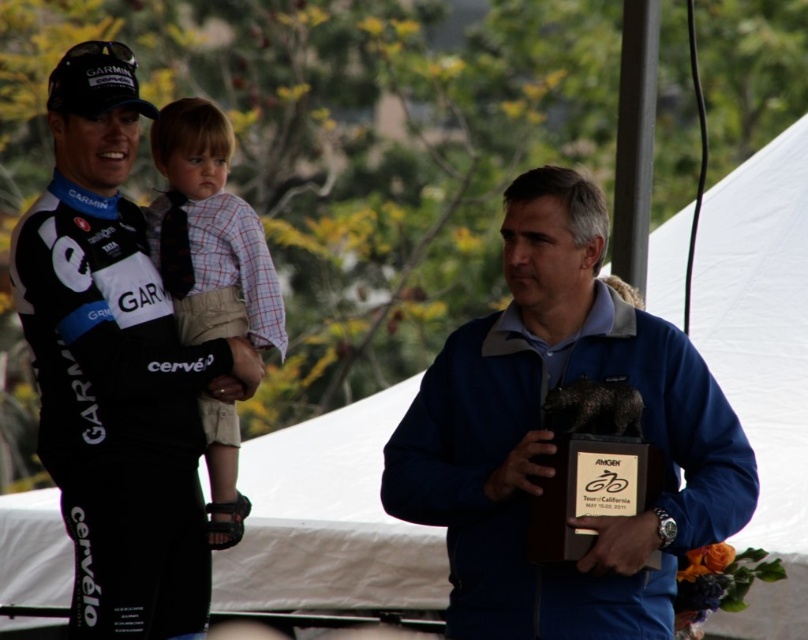
Question: Among these objects, which one is farthest from the camera?

Choices:
 (A) matte black cycling jersey at center
 (B) plaid shirt at center
 (C) blue fabric jacket at center

Answer: (B)

Question: Which of the following is the closest to the observer?

Choices:
 (A) plaid shirt at center
 (B) blue fabric jacket at center
 (C) matte black cycling jersey at center

Answer: (B)

Question: Which of the following is the closest to the observer?

Choices:
 (A) (154, 147)
 (B) (405, 428)
 (C) (205, 552)

Answer: (B)

Question: Can you confirm if matte black cycling jersey at center is positioned below plaid shirt at center?

Choices:
 (A) yes
 (B) no

Answer: (A)

Question: Does matte black cycling jersey at center have a larger size compared to plaid shirt at center?

Choices:
 (A) no
 (B) yes

Answer: (B)

Question: Can you confirm if matte black cycling jersey at center is positioned below plaid shirt at center?

Choices:
 (A) no
 (B) yes

Answer: (B)